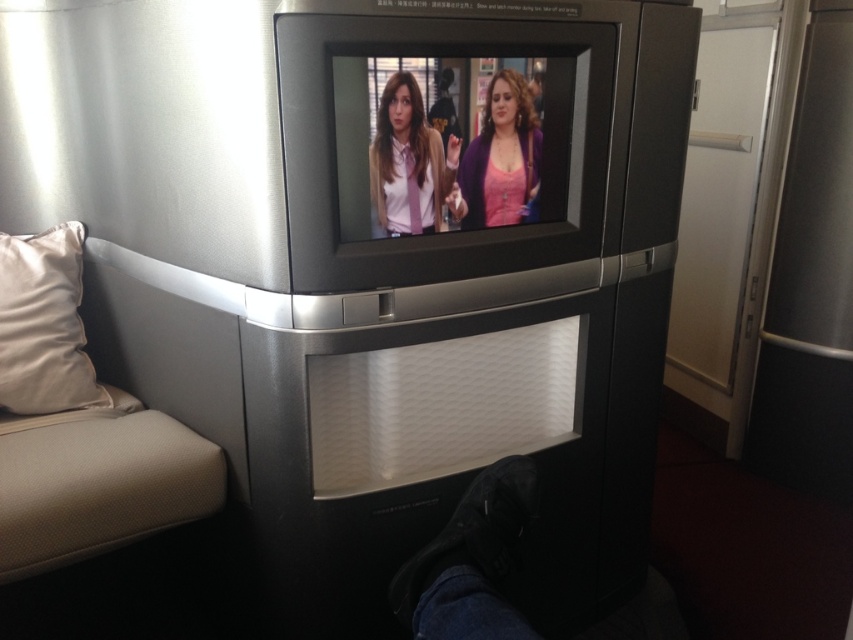
Question: Which point is farther from the camera taking this photo?

Choices:
 (A) (431, 192)
 (B) (532, 198)

Answer: (B)

Question: Is matte pink tie at center below pink matte sweater at center?

Choices:
 (A) no
 (B) yes

Answer: (B)

Question: Which point appears farthest from the camera in this image?

Choices:
 (A) (61, 403)
 (B) (465, 161)
 (C) (451, 179)

Answer: (A)

Question: Does beige velvet pillow at left have a larger size compared to pink matte sweater at center?

Choices:
 (A) yes
 (B) no

Answer: (A)

Question: Which point is farther from the camera taking this photo?

Choices:
 (A) (421, 211)
 (B) (517, 140)
 (C) (28, 237)

Answer: (C)

Question: Is matte pink tie at center further to camera compared to pink matte sweater at center?

Choices:
 (A) yes
 (B) no

Answer: (B)